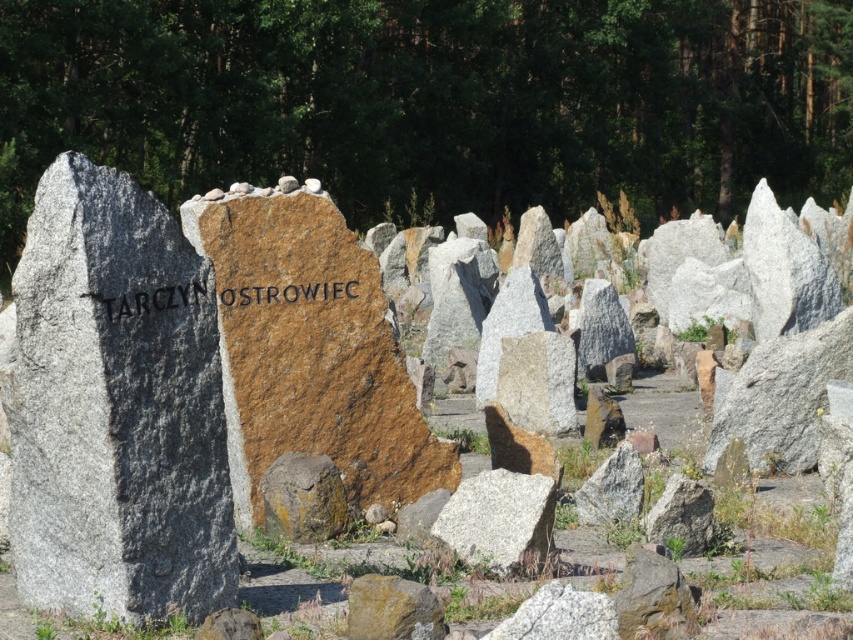
Between point (231, 496) and point (515, 490), which one is positioned in front?

Point (231, 496) is in front.

In the scene shown: Who is lower down, brown stone at center or white granite rock at center?

Positioned lower is white granite rock at center.

You are a GUI agent. You are given a task and a screenshot of the screen. Output one action in this format:
    pyautogui.click(x=<x>, y=<y>)
    Task: Click on the brown stone at center
    This screenshot has width=853, height=640.
    Given the screenshot: What is the action you would take?
    pyautogui.click(x=309, y=349)

Locate an element on the screen. brown stone at center is located at coordinates (309, 349).

Describe the element at coordinates (309, 349) in the screenshot. The height and width of the screenshot is (640, 853). I see `brown stone at center` at that location.

How far apart are brown stone at center and yellowish-brown rock at center?

brown stone at center and yellowish-brown rock at center are 11.93 inches apart.

You are a GUI agent. You are given a task and a screenshot of the screen. Output one action in this format:
    pyautogui.click(x=<x>, y=<y>)
    Task: Click on the brown stone at center
    
    Given the screenshot: What is the action you would take?
    tap(309, 349)

Is yellowish-brown rock at center wider than brown stone engraving at center?

In fact, yellowish-brown rock at center might be narrower than brown stone engraving at center.

Is yellowish-brown rock at center to the right of brown stone engraving at center from the viewer's perspective?

Indeed, yellowish-brown rock at center is positioned on the right side of brown stone engraving at center.

The width and height of the screenshot is (853, 640). What do you see at coordinates (303, 497) in the screenshot?
I see `yellowish-brown rock at center` at bounding box center [303, 497].

I want to click on yellowish-brown rock at center, so click(303, 497).